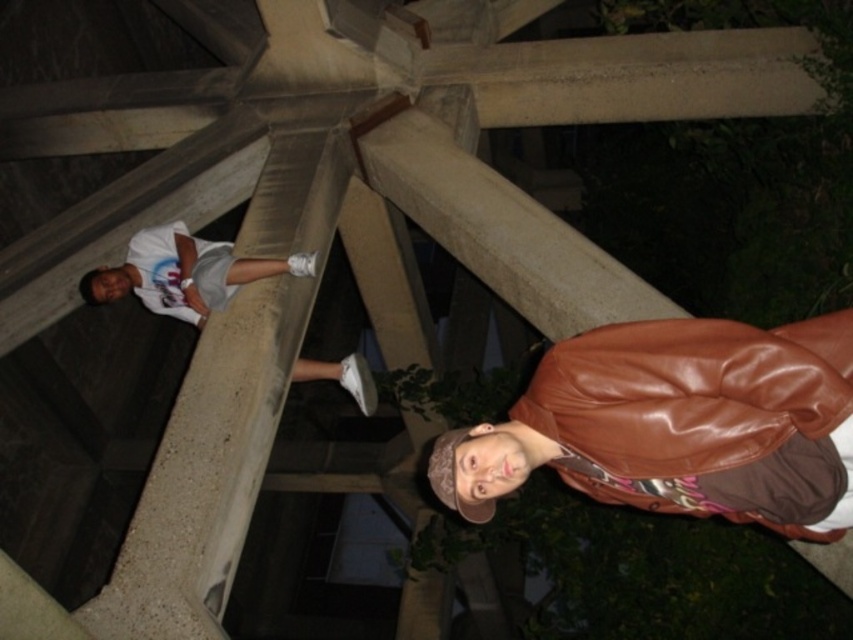
Can you confirm if brown leather jacket at lower right is thinner than white cotton shirt at upper left?

Incorrect, brown leather jacket at lower right's width is not less than white cotton shirt at upper left's.

Which is behind, point (827, 412) or point (202, 284)?

Point (202, 284)

Image resolution: width=853 pixels, height=640 pixels. Identify the location of brown leather jacket at lower right. (666, 417).

The width and height of the screenshot is (853, 640). Find the location of `brown leather jacket at lower right`. brown leather jacket at lower right is located at coordinates (666, 417).